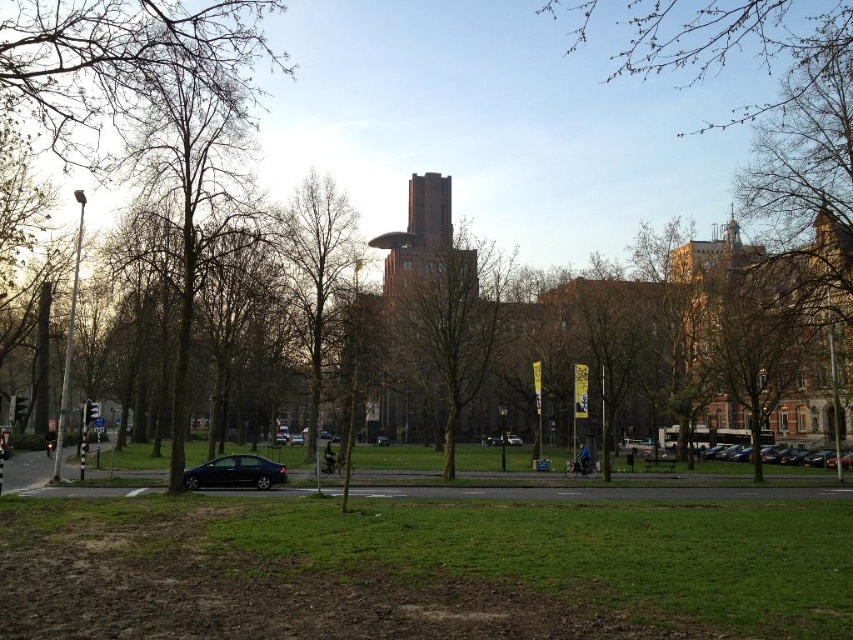
Question: Which object is closer to the camera taking this photo?

Choices:
 (A) black matte car at center
 (B) shiny black sedan at lower left
 (C) brown brick tower at center
 (D) bare branches at left

Answer: (D)

Question: Can you confirm if green leafy tree at center is positioned to the left of shiny silver car at center?

Choices:
 (A) yes
 (B) no

Answer: (A)

Question: Where is brown brick tower at center located in relation to shiny black sedan at lower left in the image?

Choices:
 (A) above
 (B) below

Answer: (A)

Question: Among these points, which one is nearest to the camera?

Choices:
 (A) (286, 253)
 (B) (380, 436)
 (C) (242, 152)
 (D) (447, 602)

Answer: (D)

Question: Which object is positioned farthest from the green grass at lower center?

Choices:
 (A) brown brick tower at center
 (B) green leafy tree at center

Answer: (A)

Question: From the image, what is the correct spatial relationship of bare branches at left in relation to black matte car at center?

Choices:
 (A) below
 (B) above

Answer: (B)